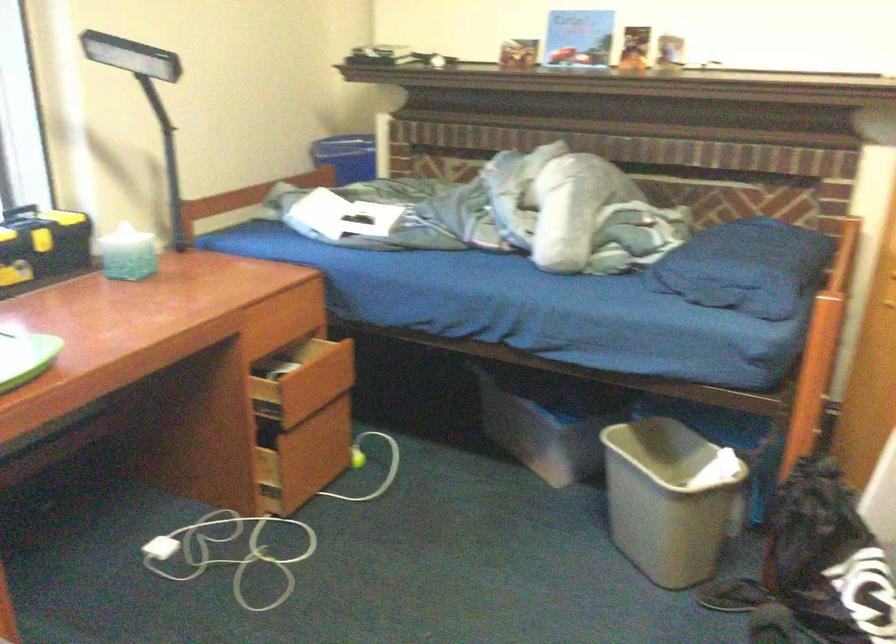
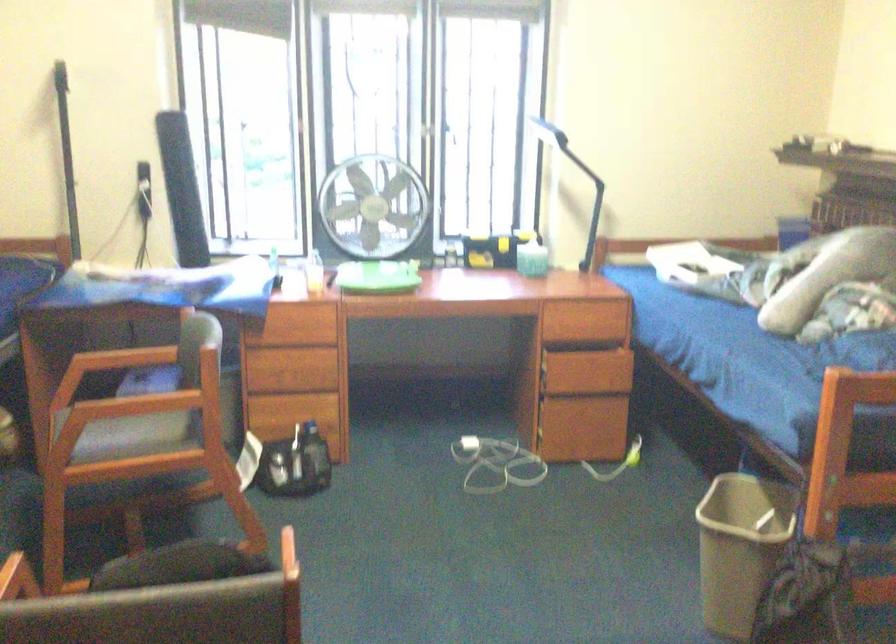
In the second image, find the point that corresponds to (286,321) in the first image.

(596, 319)